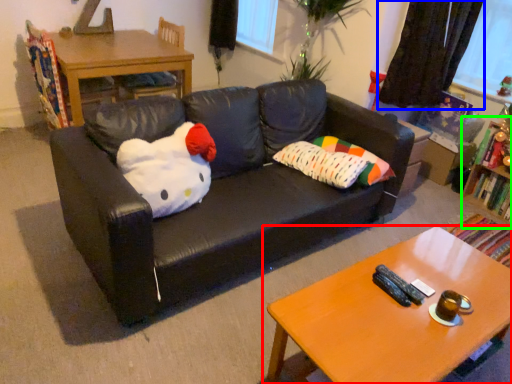
Question: Estimate the real-world distances between objects in this image. Which object is farther from coffee table (highlighted by a red box), curtain (highlighted by a blue box) or bookshelf (highlighted by a green box)?

Choices:
 (A) curtain
 (B) bookshelf

Answer: (A)